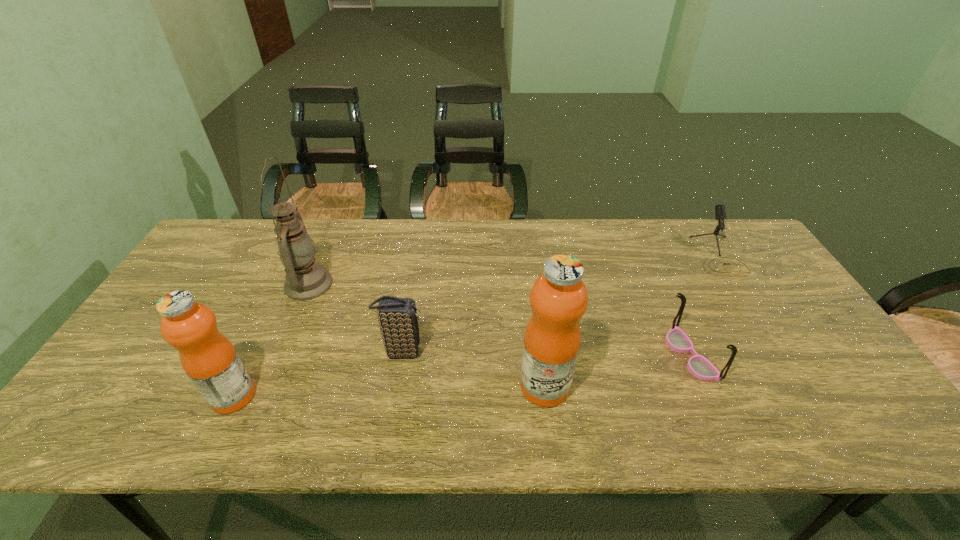
Identify the location of free space at the near edge of the desktop. (794, 396).

Locate an element on the screen. The width and height of the screenshot is (960, 540). vacant space at the left edge of the desktop is located at coordinates (158, 320).

Locate an element on the screen. free space at the right edge of the desktop is located at coordinates (789, 350).

In the image, there is a desktop. Identify the location of free region at the near right corner. (847, 375).

Find the location of `vacant area that lies between the shorter fruit juice and the third object from right to left`. vacant area that lies between the shorter fruit juice and the third object from right to left is located at coordinates (389, 391).

You are a GUI agent. You are given a task and a screenshot of the screen. Output one action in this format:
    pyautogui.click(x=<x>, y=<y>)
    Task: Click on the empty space that is in between the microphone and the fourth shortest object
    This screenshot has height=540, width=960.
    Given the screenshot: What is the action you would take?
    pyautogui.click(x=475, y=326)

Locate an element on the screen. The height and width of the screenshot is (540, 960). vacant area that lies between the right fruit juice and the microphone is located at coordinates (631, 321).

The height and width of the screenshot is (540, 960). What are the coordinates of `free space between the shorter fruit juice and the oil lamp` in the screenshot? It's located at (271, 340).

Where is `free space between the right fruit juice and the oil lamp`? free space between the right fruit juice and the oil lamp is located at coordinates (426, 335).

Find the location of a particular element. Image resolution: width=960 pixels, height=540 pixels. unoccupied area between the rightmost object and the taller fruit juice is located at coordinates (631, 321).